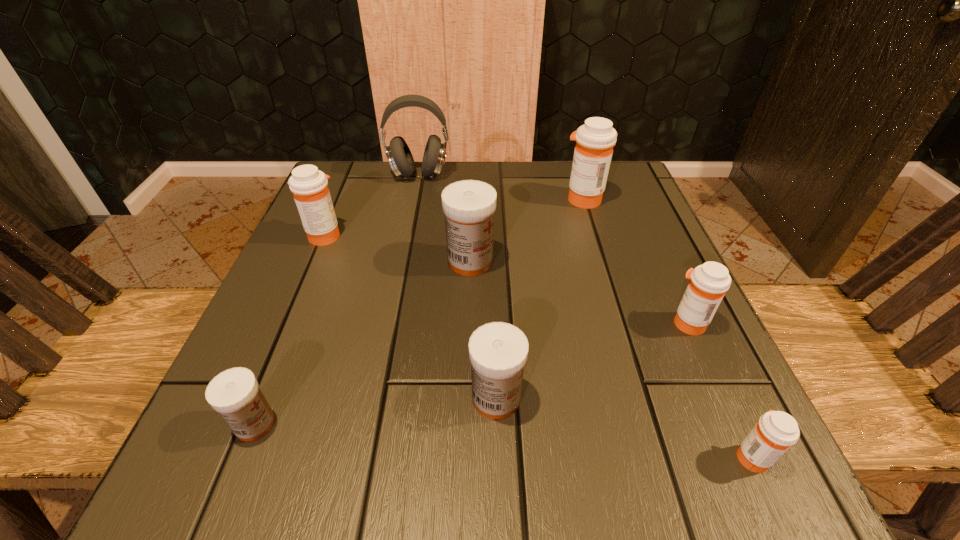
The height and width of the screenshot is (540, 960). Find the location of `the farthest object`. the farthest object is located at coordinates (399, 156).

I want to click on headset, so (x=399, y=156).

This screenshot has height=540, width=960. I want to click on the farthest medicine, so click(x=595, y=140).

At what (x,y) coordinates should I click in order to perform the action: click on the tallest medicine. Please return your answer as a coordinate pair (x, y). The width and height of the screenshot is (960, 540). Looking at the image, I should click on (595, 140).

Locate an element on the screen. This screenshot has width=960, height=540. the second biggest orange medicine is located at coordinates (308, 184).

Where is `the leftmost orange medicine`? The image size is (960, 540). the leftmost orange medicine is located at coordinates (308, 184).

At what (x,y) coordinates should I click in order to perform the action: click on the farthest white medicine. Please return your answer as a coordinate pair (x, y). Looking at the image, I should click on (469, 205).

You are a GUI agent. You are given a task and a screenshot of the screen. Output one action in this format:
    pyautogui.click(x=<x>, y=<y>)
    Task: Click on the fifth farthest object
    
    Given the screenshot: What is the action you would take?
    pyautogui.click(x=709, y=282)

Locate an element on the screen. the second smallest orange medicine is located at coordinates pos(709,282).

Where is `the second biggest white medicine`? This screenshot has width=960, height=540. the second biggest white medicine is located at coordinates (498, 351).